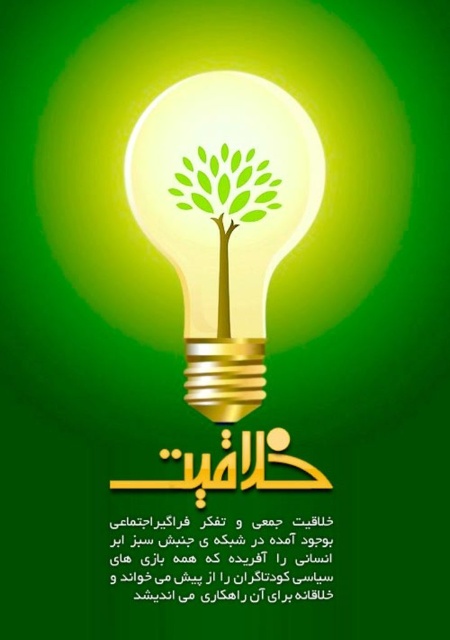
You are an architect designing a circular room with a diameter of 10 meters. You want to place a decorative gold metallic bulb at center exactly at the center of the room. However, due to structural constraints, the bulb must be placed at coordinates point 0.341, 0.500 relative to the room. Will the bulb be placed at the center of the room?

The gold metallic bulb at center is positioned at point (225, 218), which is not the exact center of the room. The center would be at coordinates (225, 320). Therefore, the bulb will not be placed at the center of the room.

You are an interior designer planning to hang a gold metallic bulb at center and a green matte tree at center in a room. Based on the scene description, which object should be placed higher to maintain the correct spatial relationship?

The green matte tree at center should be placed higher because the gold metallic bulb at center is positioned under it according to the description.